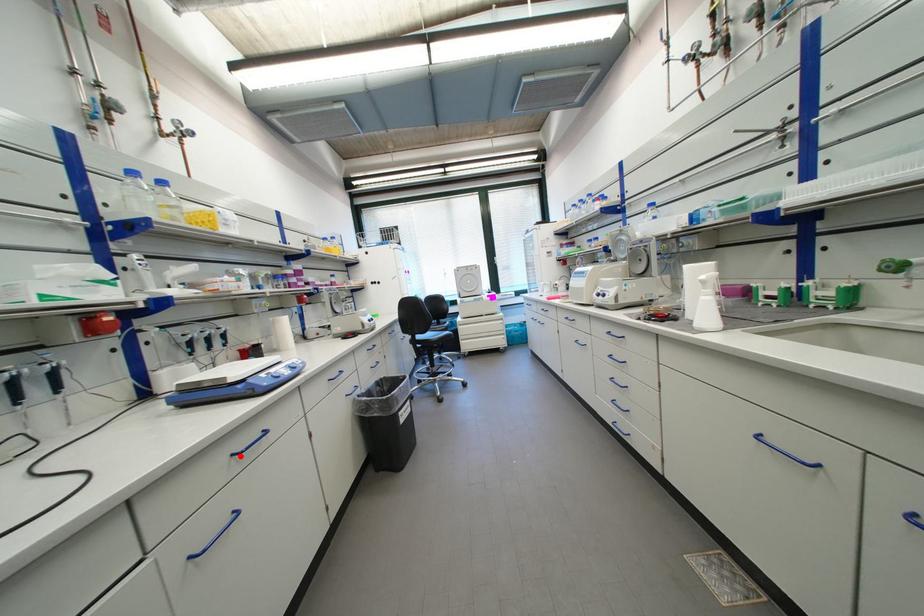
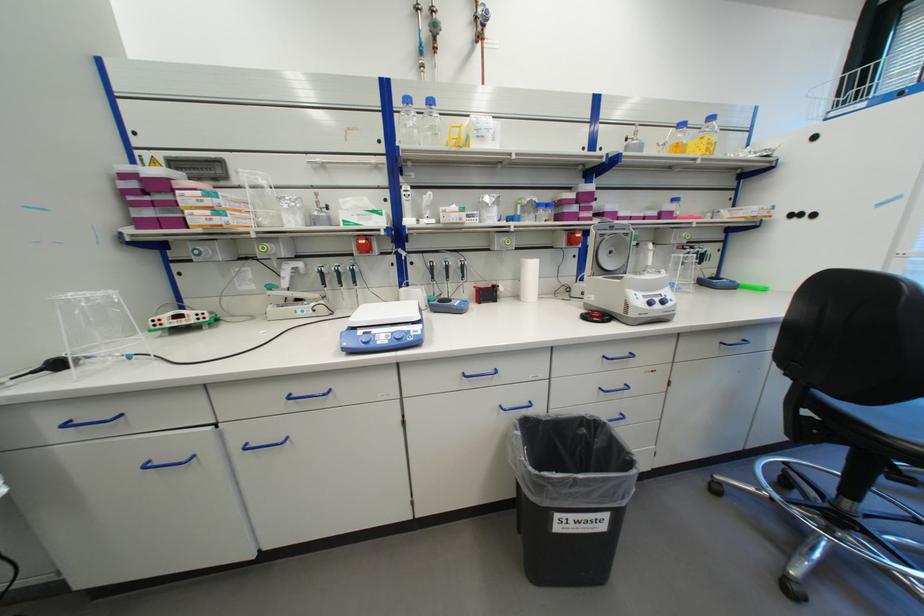
Question: I am providing you with two images of the same scene from different viewpoints. A red point is marked on the first image. At the location where the point appears in image 1, is it still visible in image 2?

Choices:
 (A) Yes
 (B) No

Answer: (A)